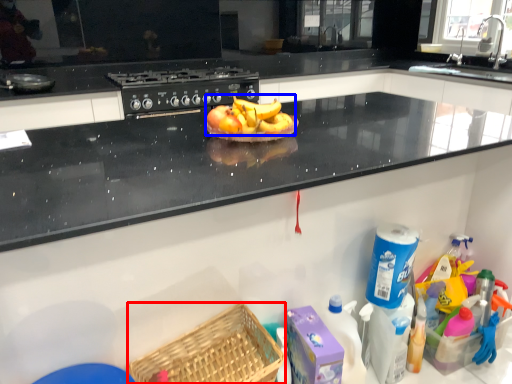
Question: Which object appears closest to the camera in this image, basket (highlighted by a red box) or banana (highlighted by a blue box)?

Choices:
 (A) basket
 (B) banana

Answer: (A)